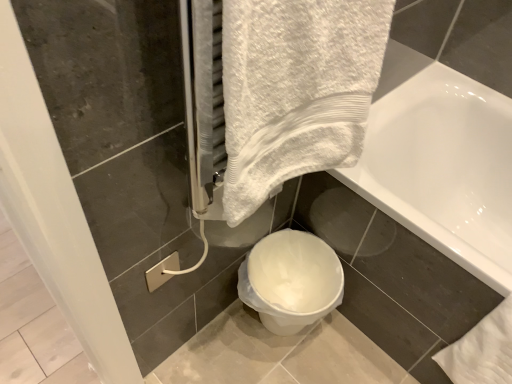
Locate an element on the screen. The image size is (512, 384). white plastic toilet at lower center is located at coordinates (291, 280).

Describe the element at coordinates (291, 280) in the screenshot. The width and height of the screenshot is (512, 384). I see `white plastic toilet at lower center` at that location.

Where is `white glossy bathtub at upper right`? The image size is (512, 384). white glossy bathtub at upper right is located at coordinates (441, 162).

Describe the element at coordinates (441, 162) in the screenshot. The width and height of the screenshot is (512, 384). I see `white glossy bathtub at upper right` at that location.

Image resolution: width=512 pixels, height=384 pixels. I want to click on white plastic toilet at lower center, so click(x=291, y=280).

Consider the image. Does white plastic toilet at lower center appear on the right side of white glossy bathtub at upper right?

Incorrect, white plastic toilet at lower center is not on the right side of white glossy bathtub at upper right.

Relative to white glossy bathtub at upper right, is white plastic toilet at lower center in front or behind?

white plastic toilet at lower center is behind white glossy bathtub at upper right.

Considering the positions of point (332, 299) and point (430, 238), is point (332, 299) closer or farther from the camera than point (430, 238)?

Point (332, 299) is positioned farther from the camera compared to point (430, 238).

From the image's perspective, does white plastic toilet at lower center appear higher than white glossy bathtub at upper right?

No, from the image's perspective, white plastic toilet at lower center is not above white glossy bathtub at upper right.

From a real-world perspective, is white plastic toilet at lower center physically located above or below white glossy bathtub at upper right?

white plastic toilet at lower center is below white glossy bathtub at upper right.

Between white plastic toilet at lower center and white glossy bathtub at upper right, which one has smaller width?

With smaller width is white plastic toilet at lower center.

Can you confirm if white plastic toilet at lower center is taller than white glossy bathtub at upper right?

Incorrect, the height of white plastic toilet at lower center is not larger of that of white glossy bathtub at upper right.

Looking at the image, does white plastic toilet at lower center seem bigger or smaller compared to white glossy bathtub at upper right?

Considering their sizes, white plastic toilet at lower center takes up less space than white glossy bathtub at upper right.

Does white plastic toilet at lower center contain white glossy bathtub at upper right?

That's incorrect, white glossy bathtub at upper right is not inside white plastic toilet at lower center.

Consider the image. Is white plastic toilet at lower center directly adjacent to white glossy bathtub at upper right?

No, white plastic toilet at lower center is not with white glossy bathtub at upper right.

Could you tell me if white plastic toilet at lower center is turned towards white glossy bathtub at upper right?

No.

Locate an element on the screen. Image resolution: width=512 pixels, height=384 pixels. toilet to the left of white glossy bathtub at upper right is located at coordinates (291, 280).

Which object is positioned more to the right, white glossy bathtub at upper right or white plastic toilet at lower center?

Positioned to the right is white glossy bathtub at upper right.

Between white glossy bathtub at upper right and white plastic toilet at lower center, which one is positioned in front?

white glossy bathtub at upper right.

Which is closer to the camera, (400, 162) or (250, 284)?

Point (400, 162).

From the image's perspective, is white glossy bathtub at upper right on top of white plastic toilet at lower center?

Indeed, from the image's perspective, white glossy bathtub at upper right is shown above white plastic toilet at lower center.

From a real-world perspective, is white glossy bathtub at upper right physically above white plastic toilet at lower center?

Yes.

Is white glossy bathtub at upper right thinner than white plastic toilet at lower center?

Incorrect, the width of white glossy bathtub at upper right is not less than that of white plastic toilet at lower center.

Who is taller, white glossy bathtub at upper right or white plastic toilet at lower center?

With more height is white glossy bathtub at upper right.

In terms of size, does white glossy bathtub at upper right appear bigger or smaller than white plastic toilet at lower center?

white glossy bathtub at upper right is bigger than white plastic toilet at lower center.

From the picture: Is white glossy bathtub at upper right completely or partially outside of white plastic toilet at lower center?

white glossy bathtub at upper right is positioned outside white plastic toilet at lower center.

Is white glossy bathtub at upper right with white plastic toilet at lower center?

No, white glossy bathtub at upper right is not touching white plastic toilet at lower center.

Is white glossy bathtub at upper right facing towards white plastic toilet at lower center?

Yes, white glossy bathtub at upper right is aimed at white plastic toilet at lower center.

The height and width of the screenshot is (384, 512). I want to click on toilet on the left side of white glossy bathtub at upper right, so click(x=291, y=280).

In order to click on bathtub in front of the white plastic toilet at lower center in this screenshot , I will do `click(441, 162)`.

At what (x,y) coordinates should I click in order to perform the action: click on toilet behind the white glossy bathtub at upper right. Please return your answer as a coordinate pair (x, y). Looking at the image, I should click on (291, 280).